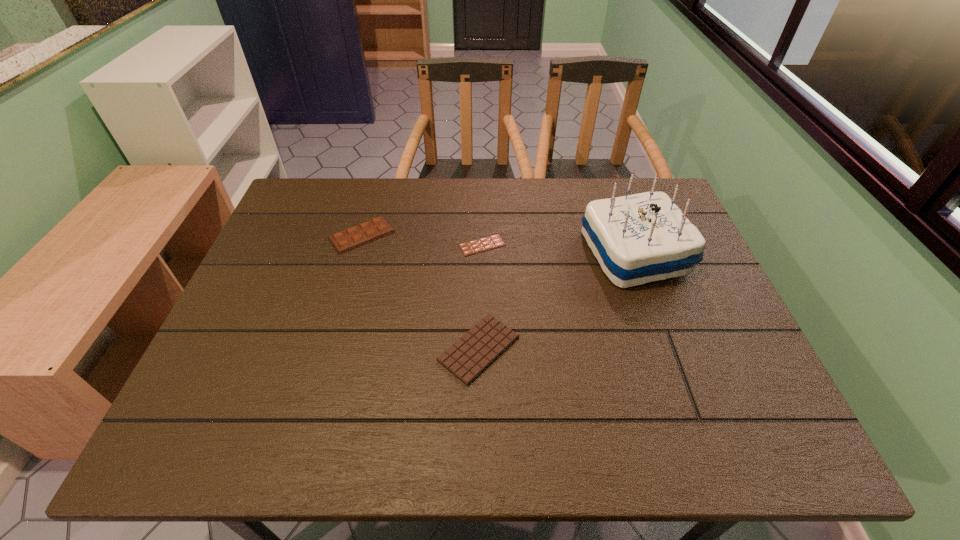
What are the coordinates of `vacant area at the right edge` in the screenshot? It's located at (684, 340).

Where is `vacant space at the far left corner`? The height and width of the screenshot is (540, 960). vacant space at the far left corner is located at coordinates (317, 197).

At what (x,y) coordinates should I click in order to perform the action: click on empty space between the shortest chocolate bar and the leftmost chocolate bar. Please return your answer as a coordinate pair (x, y). Image resolution: width=960 pixels, height=540 pixels. Looking at the image, I should click on (422, 240).

Where is `empty space between the second tallest chocolate bar and the rightmost object`? The width and height of the screenshot is (960, 540). empty space between the second tallest chocolate bar and the rightmost object is located at coordinates (557, 301).

Locate an element on the screen. Image resolution: width=960 pixels, height=540 pixels. vacant space that is in between the tallest chocolate bar and the shortest chocolate bar is located at coordinates (422, 240).

The image size is (960, 540). Find the location of `free point between the nearest object and the shortest chocolate bar`. free point between the nearest object and the shortest chocolate bar is located at coordinates (481, 297).

Locate an element on the screen. free spot between the birthday cake and the shortest object is located at coordinates (559, 249).

Where is `blank region between the shortest chocolate bar and the tallest object`? blank region between the shortest chocolate bar and the tallest object is located at coordinates (559, 249).

Locate an element on the screen. empty location between the shortest object and the nearest chocolate bar is located at coordinates click(481, 297).

Locate an element on the screen. free spot between the second shortest chocolate bar and the birthday cake is located at coordinates (557, 301).